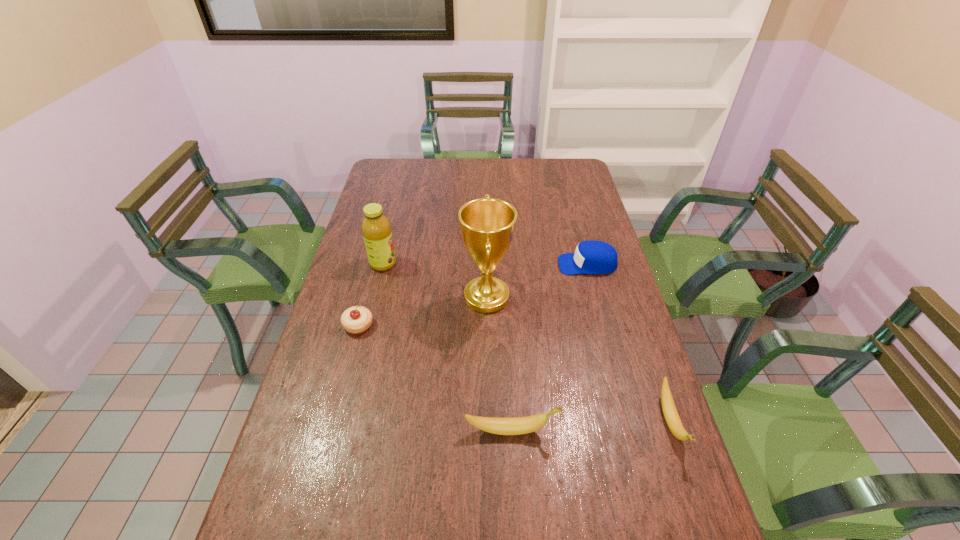
Image resolution: width=960 pixels, height=540 pixels. I want to click on free area in between the fruit juice and the shortest object, so click(371, 294).

Identify the location of vacant area between the fruit juice and the tallest object. (435, 280).

In order to click on free space between the shorter banana and the shortest object in this screenshot , I will do `click(515, 373)`.

Locate an element on the screen. The image size is (960, 540). vacant space that's between the fifth shortest object and the tallest object is located at coordinates (435, 280).

At what (x,y) coordinates should I click in order to perform the action: click on free space between the baseball cap and the shorter banana. Please return your answer as a coordinate pair (x, y). The image size is (960, 540). Looking at the image, I should click on (629, 343).

Identify the location of object that is the fourth closest to the baseball cap. This screenshot has width=960, height=540. (x=376, y=228).

Identify which object is located as the third nearest to the fifth shortest object. Please provide its 2D coordinates. Your answer should be formatted as a tuple, i.e. [(x, y)], where the tuple contains the x and y coordinates of a point satisfying the conditions above.

[(591, 257)]

In order to click on free space that satisfies the following two spatial constraints: 1. by the handles of the award; 2. on the front side of the shortest object in this screenshot , I will do `click(487, 325)`.